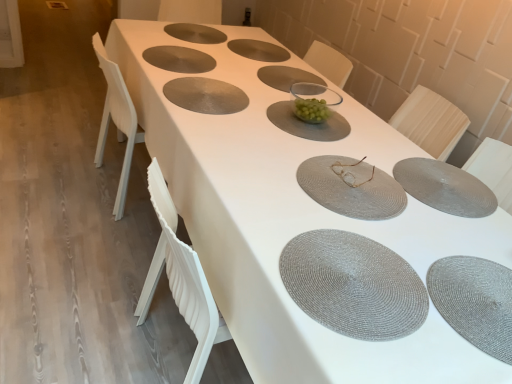
Where is `vacant space in between matte gray placemat at upper center, the third tableware from the top, and matte gray placemat at center, which is counted as the third tableware, starting from the bottom`? This screenshot has height=384, width=512. vacant space in between matte gray placemat at upper center, the third tableware from the top, and matte gray placemat at center, which is counted as the third tableware, starting from the bottom is located at coordinates (247, 115).